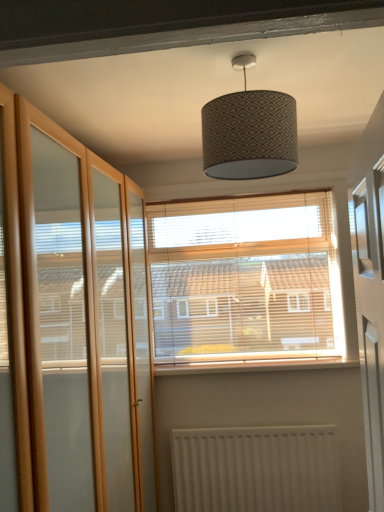
Question: Considering the positions of point (268, 251) and point (175, 484), is point (268, 251) closer or farther from the camera than point (175, 484)?

Choices:
 (A) closer
 (B) farther

Answer: (B)

Question: In the image, is wooden blinds at center positioned in front of or behind white textured radiator at lower center?

Choices:
 (A) front
 (B) behind

Answer: (B)

Question: Estimate the real-world distances between objects in this image. Which object is closer to the white textured radiator at lower center?

Choices:
 (A) patterned fabric lampshade at center
 (B) white painted wood at center
 (C) wooden blinds at center
 (D) clear glass screen door at left

Answer: (B)

Question: Based on their relative distances, which object is nearer to the wooden blinds at center?

Choices:
 (A) white painted wood at center
 (B) patterned fabric lampshade at center
 (C) white textured radiator at lower center
 (D) clear glass screen door at left

Answer: (A)